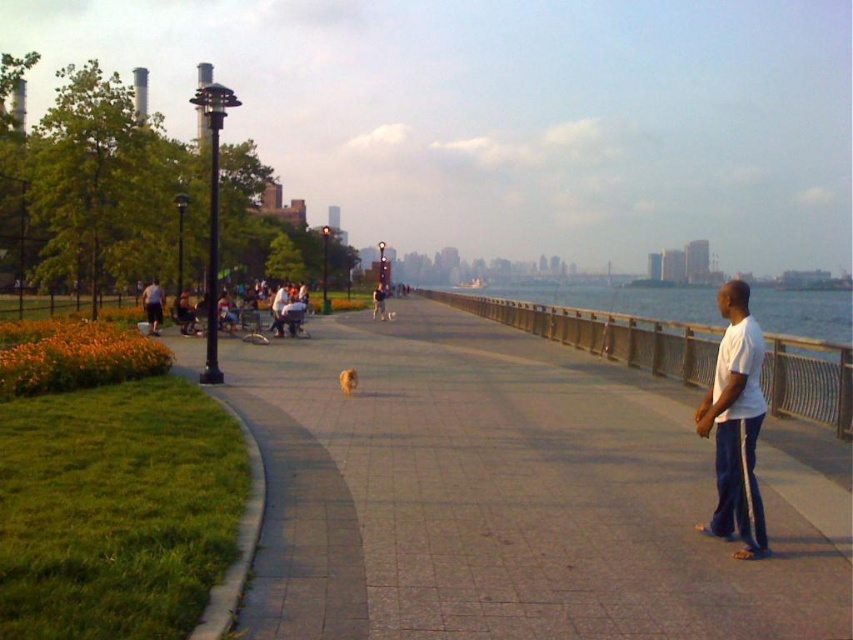
Can you confirm if brown brick pavement at center is shorter than white cotton shirt at center?

Correct, brown brick pavement at center is not as tall as white cotton shirt at center.

What do you see at coordinates (509, 497) in the screenshot? I see `brown brick pavement at center` at bounding box center [509, 497].

I want to click on brown brick pavement at center, so click(509, 497).

What are the coordinates of `brown brick pavement at center` in the screenshot? It's located at (509, 497).

Which is more to the left, white smooth shirt at right or matte black stroller at left?

matte black stroller at left is more to the left.

Is point (728, 483) closer to viewer compared to point (177, 320)?

Yes, point (728, 483) is closer to viewer.

Locate an element on the screen. The width and height of the screenshot is (853, 640). white smooth shirt at right is located at coordinates (735, 422).

Which is more to the right, clear glass waterway at center or golden fur dog at center?

clear glass waterway at center

Who is higher up, clear glass waterway at center or golden fur dog at center?

clear glass waterway at center

Where is `clear glass waterway at center`? The image size is (853, 640). clear glass waterway at center is located at coordinates (605, 333).